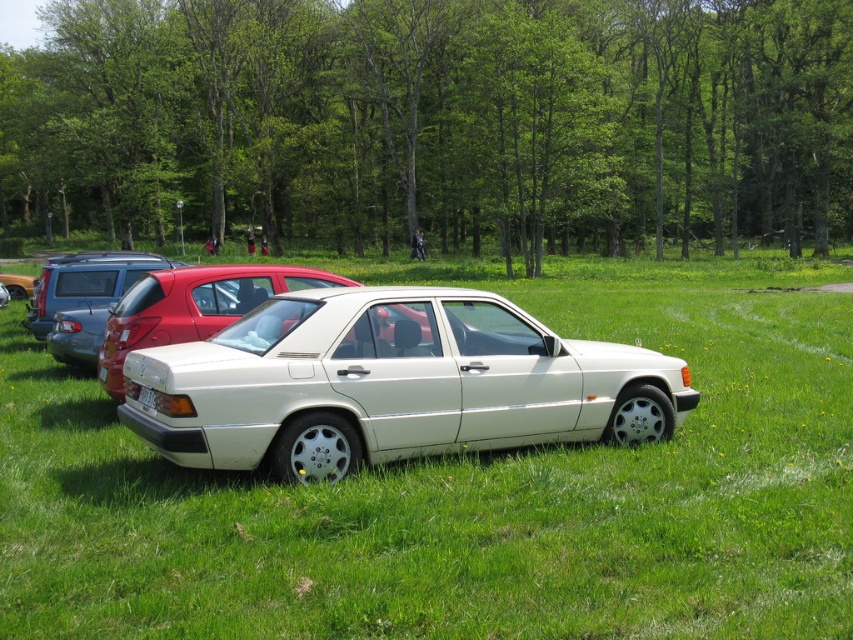
Who is lower down, satin white sedan at center or matte black hatchback at left?

Positioned lower is matte black hatchback at left.

Is satin white sedan at center further to camera compared to matte black hatchback at left?

No, it is in front of matte black hatchback at left.

Describe the element at coordinates (193, 307) in the screenshot. Image resolution: width=853 pixels, height=640 pixels. I see `satin white sedan at center` at that location.

Where is `satin white sedan at center`? The width and height of the screenshot is (853, 640). satin white sedan at center is located at coordinates (193, 307).

Who is positioned more to the left, matte black hatchback at left or white plastic license plate at center?

matte black hatchback at left is more to the left.

Describe the element at coordinates (86, 282) in the screenshot. The height and width of the screenshot is (640, 853). I see `matte black hatchback at left` at that location.

Find the location of `matte black hatchback at left`. matte black hatchback at left is located at coordinates (86, 282).

Which is behind, point (543, 490) or point (114, 392)?

Positioned behind is point (114, 392).

What are the coordinates of `white glossy sedan at center` in the screenshot? It's located at (469, 490).